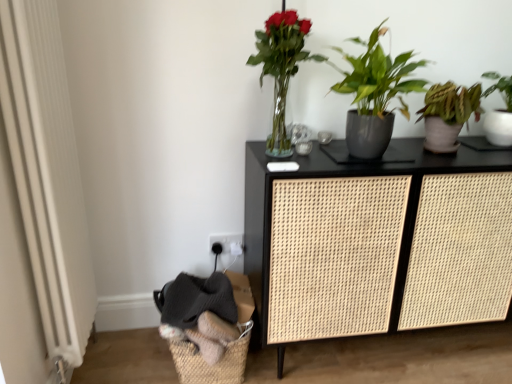
The height and width of the screenshot is (384, 512). Find the location of `vacant area situated below white textured radiator at left (from a real-world perspective)`. vacant area situated below white textured radiator at left (from a real-world perspective) is located at coordinates (90, 363).